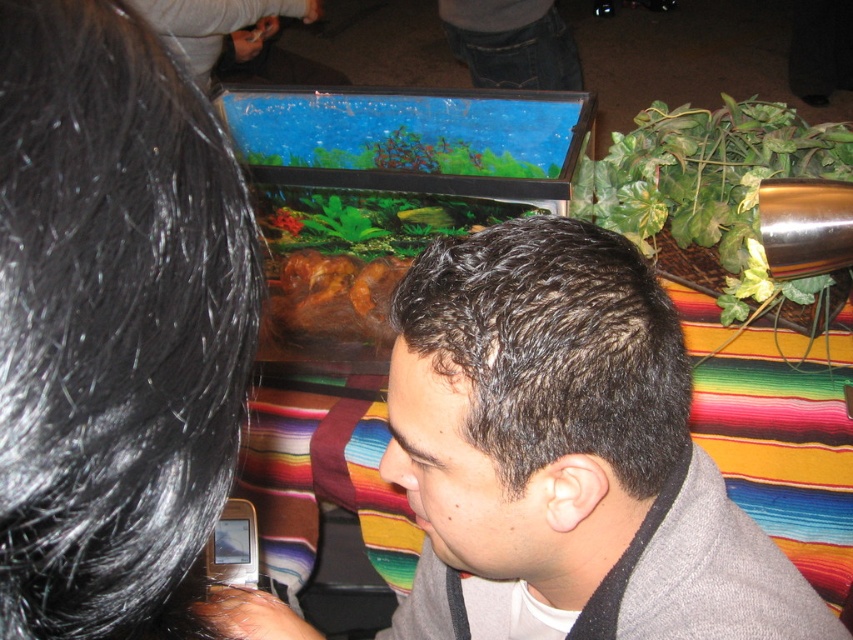
Does dark gray fabric at center have a greater width compared to metallic silver phone at lower left?

Indeed, dark gray fabric at center has a greater width compared to metallic silver phone at lower left.

From the picture: Is dark gray fabric at center closer to the viewer compared to metallic silver phone at lower left?

Yes.

Who is more forward, (439,390) or (231,566)?

Point (439,390)

Where is `dark gray fabric at center`? This screenshot has width=853, height=640. dark gray fabric at center is located at coordinates (566, 451).